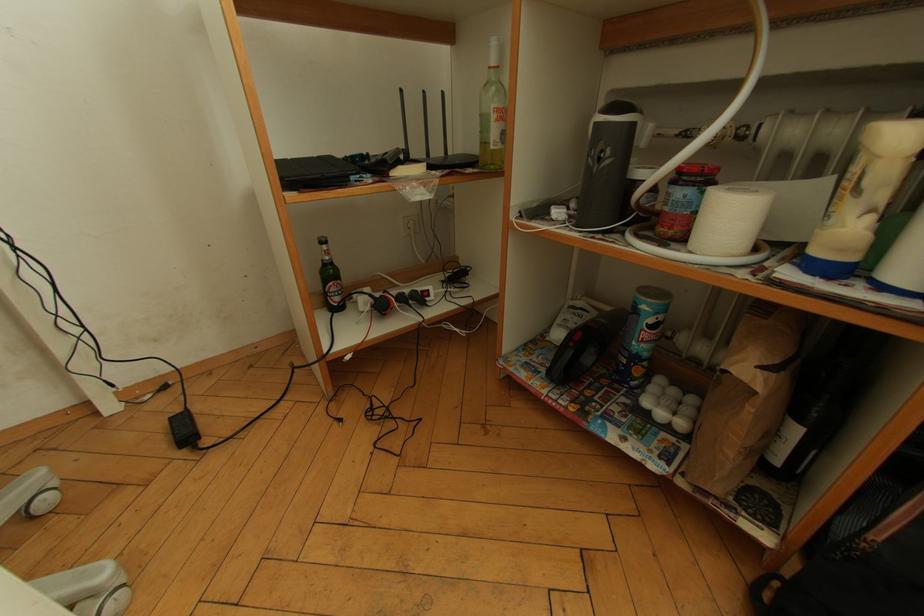
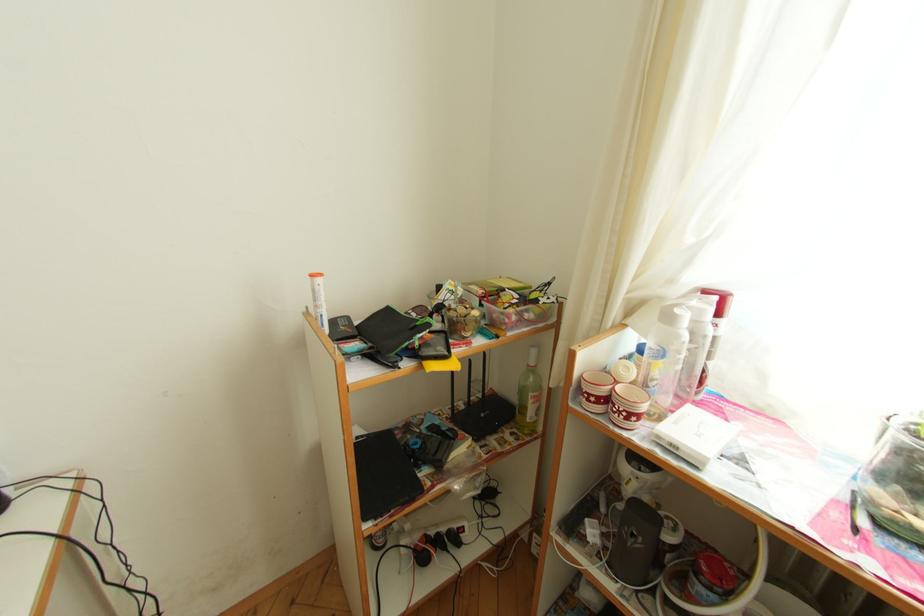
Question: Based on the continuous images, in which direction is the camera rotating? Reply with the corresponding letter.

Choices:
 (A) Left
 (B) Right
 (C) Up
 (D) Down

Answer: (C)